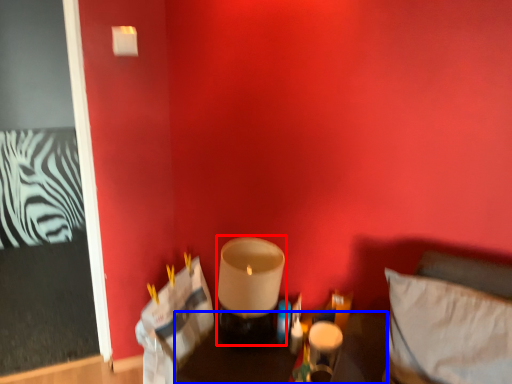
Question: Among these objects, which one is nearest to the camera, candle holder (highlighted by a red box) or furniture (highlighted by a blue box)?

Choices:
 (A) candle holder
 (B) furniture

Answer: (B)